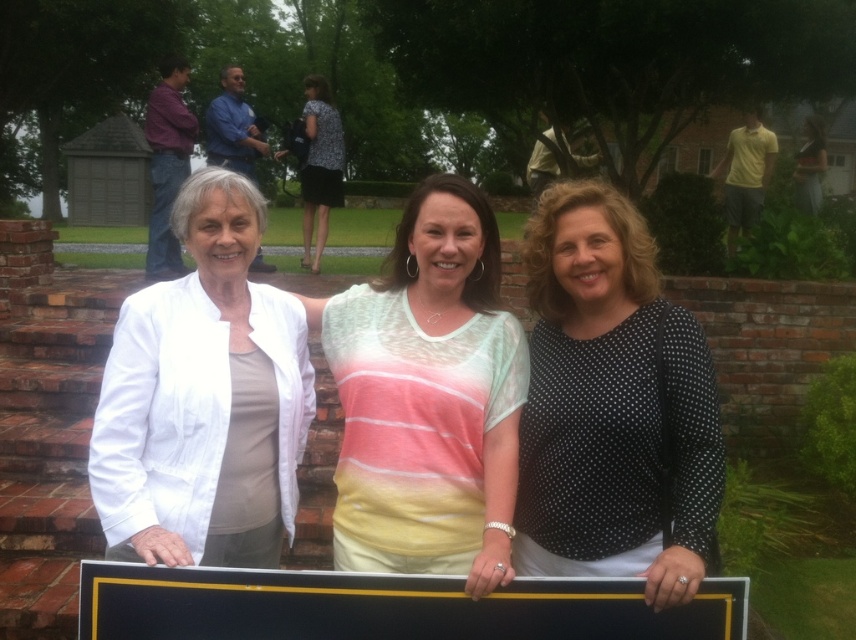
Can you confirm if black dotted blouse at center is bigger than black matte plaque at center?

Correct, black dotted blouse at center is larger in size than black matte plaque at center.

Is black dotted blouse at center below black matte plaque at center?

No.

Is point (669, 380) behind point (93, 630)?

Yes, it is.

Identify the location of black dotted blouse at center. (611, 404).

This screenshot has height=640, width=856. Describe the element at coordinates (204, 397) in the screenshot. I see `white matte jacket at left` at that location.

Which is in front, point (281, 458) or point (474, 380)?

Point (474, 380) is in front.

I want to click on white matte jacket at left, so click(204, 397).

Is the position of white matte jacket at left more distant than that of black matte plaque at center?

No.

Does point (181, 497) come farther from viewer compared to point (503, 627)?

Yes, point (181, 497) is behind point (503, 627).

Is point (201, 529) less distant than point (408, 614)?

No, (201, 529) is further to viewer.

Find the location of a particular element. white matte jacket at left is located at coordinates (204, 397).